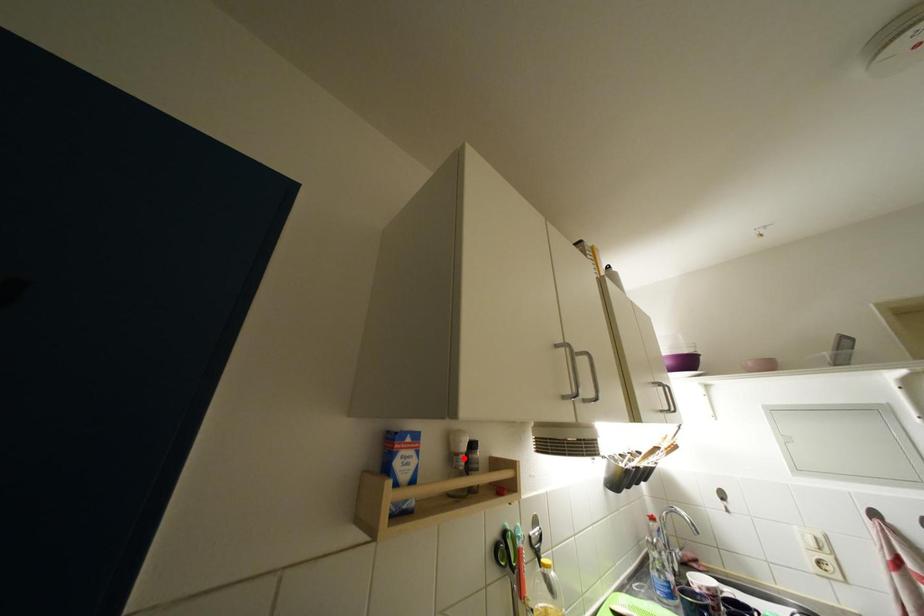
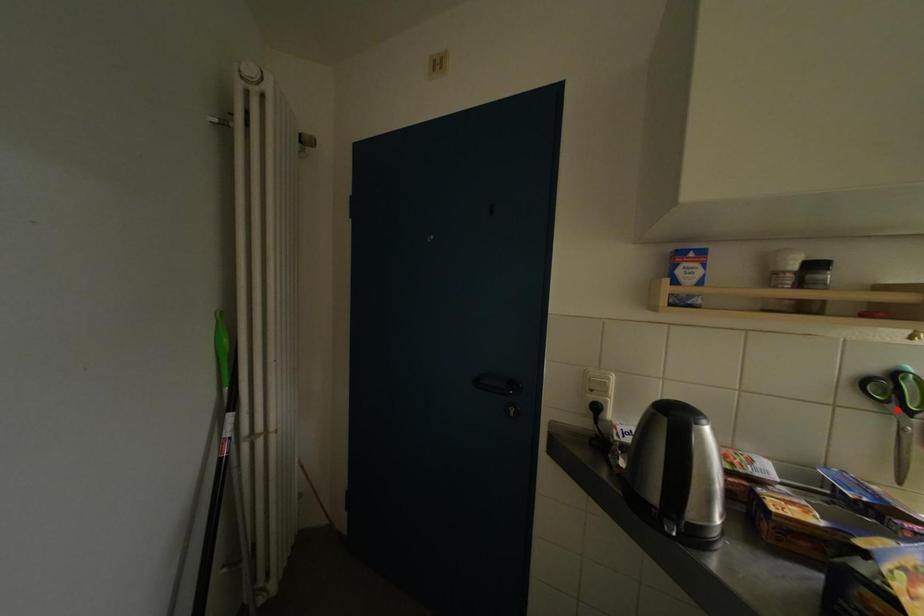
I am providing you with two images of the same scene from different viewpoints. A red point is marked on the first image and another point is marked on the second image. Are the points marked in image1 and image2 representing the same 3D position?

No